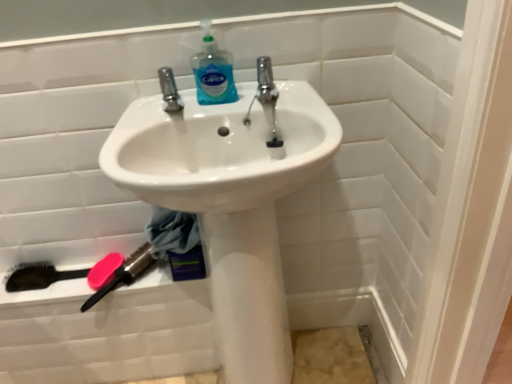
Question: Is point (257, 61) closer or farther from the camera than point (126, 261)?

Choices:
 (A) farther
 (B) closer

Answer: (B)

Question: Is polished chrome tap at center wider or thinner than pink plastic brush at lower left, the second brush viewed from the left?

Choices:
 (A) thin
 (B) wide

Answer: (A)

Question: Which is farther from the white glossy sink at center?

Choices:
 (A) blue translucent liquid at upper center
 (B) black bristle brush at lower left, placed as the 1th brush when sorted from left to right
 (C) pink rubber soap at lower left
 (D) polished chrome tap at center
 (E) pink plastic brush at lower left, the first brush when ordered from right to left

Answer: (B)

Question: Which of these objects is positioned farthest from the pink rubber soap at lower left?

Choices:
 (A) blue translucent liquid at upper center
 (B) pink plastic brush at lower left, the second brush viewed from the left
 (C) black bristle brush at lower left, placed as the 2th brush when sorted from right to left
 (D) polished chrome tap at center
 (E) white glossy sink at center

Answer: (D)